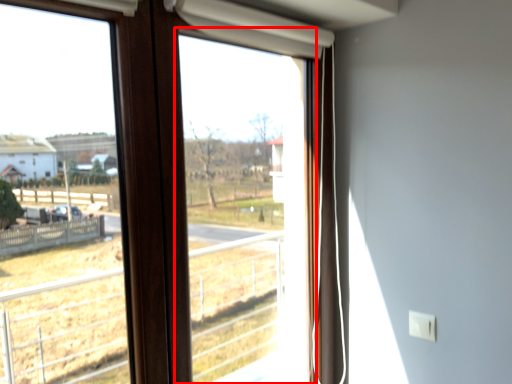
Question: Observing the image, what is the correct spatial positioning of window screen (annotated by the red box) in reference to window?

Choices:
 (A) right
 (B) left

Answer: (A)